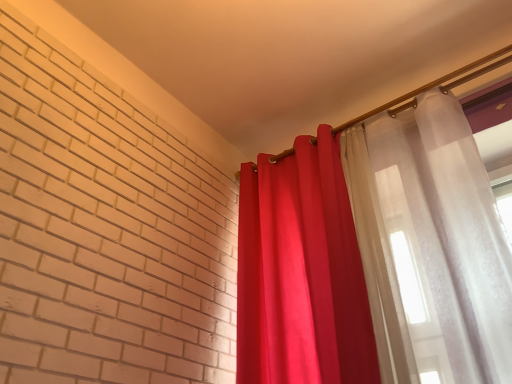
Question: Is translucent white curtain at upper right, which is the 1th curtain in right-to-left order, shorter than matte red curtain at right, the 2th curtain viewed from the right?

Choices:
 (A) no
 (B) yes

Answer: (A)

Question: Is translucent white curtain at upper right, which is the 1th curtain in right-to-left order, oriented towards matte red curtain at right, acting as the first curtain starting from the left?

Choices:
 (A) yes
 (B) no

Answer: (B)

Question: From the image's perspective, is translucent white curtain at upper right, which is counted as the second curtain, starting from the left, above matte red curtain at right, the 2th curtain viewed from the right?

Choices:
 (A) no
 (B) yes

Answer: (B)

Question: Is translucent white curtain at upper right, which is the 1th curtain in right-to-left order, closer to camera compared to matte red curtain at right, the 2th curtain viewed from the right?

Choices:
 (A) yes
 (B) no

Answer: (A)

Question: From a real-world perspective, is translucent white curtain at upper right, which is counted as the second curtain, starting from the left, on matte red curtain at right, the 2th curtain viewed from the right?

Choices:
 (A) yes
 (B) no

Answer: (B)

Question: Can you confirm if translucent white curtain at upper right, which is the 1th curtain in right-to-left order, is thinner than matte red curtain at right, the 2th curtain viewed from the right?

Choices:
 (A) no
 (B) yes

Answer: (B)

Question: Is matte red curtain at right, acting as the first curtain starting from the left, facing away from translucent white curtain at upper right, which is the 1th curtain in right-to-left order?

Choices:
 (A) yes
 (B) no

Answer: (B)

Question: From the image's perspective, would you say matte red curtain at right, the 2th curtain viewed from the right, is shown under translucent white curtain at upper right, which is counted as the second curtain, starting from the left?

Choices:
 (A) yes
 (B) no

Answer: (A)

Question: Does matte red curtain at right, acting as the first curtain starting from the left, have a lesser height compared to translucent white curtain at upper right, which is counted as the second curtain, starting from the left?

Choices:
 (A) yes
 (B) no

Answer: (A)

Question: Considering the relative sizes of matte red curtain at right, the 2th curtain viewed from the right, and translucent white curtain at upper right, which is the 1th curtain in right-to-left order, in the image provided, is matte red curtain at right, the 2th curtain viewed from the right, taller than translucent white curtain at upper right, which is the 1th curtain in right-to-left order,?

Choices:
 (A) no
 (B) yes

Answer: (A)

Question: Does matte red curtain at right, acting as the first curtain starting from the left, turn towards translucent white curtain at upper right, which is counted as the second curtain, starting from the left?

Choices:
 (A) no
 (B) yes

Answer: (A)

Question: Is matte red curtain at right, acting as the first curtain starting from the left, smaller than translucent white curtain at upper right, which is counted as the second curtain, starting from the left?

Choices:
 (A) no
 (B) yes

Answer: (A)

Question: Based on their positions, is translucent white curtain at upper right, which is the 1th curtain in right-to-left order, located to the left or right of matte red curtain at right, the 2th curtain viewed from the right?

Choices:
 (A) left
 (B) right

Answer: (B)